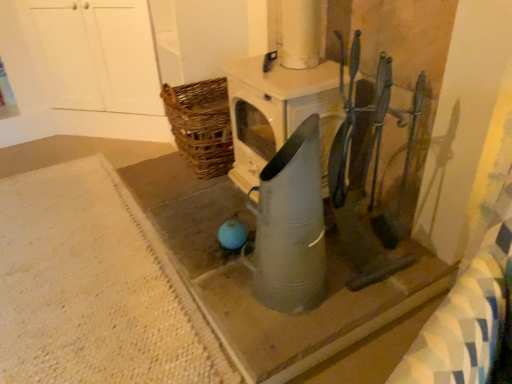
Question: Is metallic gray watering can at center, which is counted as the 2th concrete, starting from the left, located within metallic gray watering can at center?

Choices:
 (A) no
 (B) yes

Answer: (A)

Question: Could you tell me if metallic gray watering can at center is turned towards metallic gray watering can at center, which is counted as the 2th concrete, starting from the left?

Choices:
 (A) no
 (B) yes

Answer: (A)

Question: From a real-world perspective, is metallic gray watering can at center located beneath metallic gray watering can at center, which is counted as the 2th concrete, starting from the left?

Choices:
 (A) no
 (B) yes

Answer: (A)

Question: Can you confirm if metallic gray watering can at center is smaller than metallic gray watering can at center, the 1th concrete viewed from the right?

Choices:
 (A) no
 (B) yes

Answer: (B)

Question: Is metallic gray watering can at center positioned far away from metallic gray watering can at center, the 1th concrete viewed from the right?

Choices:
 (A) no
 (B) yes

Answer: (A)

Question: Which is correct: white textured rug at lower left, arranged as the second concrete when viewed from the right, is inside metallic gray watering can at center, which is counted as the 2th concrete, starting from the left, or outside of it?

Choices:
 (A) outside
 (B) inside

Answer: (A)

Question: From a real-world perspective, is white textured rug at lower left, arranged as the second concrete when viewed from the right, physically located above or below metallic gray watering can at center, which is counted as the 2th concrete, starting from the left?

Choices:
 (A) below
 (B) above

Answer: (A)

Question: Considering the positions of point (211, 345) and point (305, 319), is point (211, 345) closer or farther from the camera than point (305, 319)?

Choices:
 (A) farther
 (B) closer

Answer: (A)

Question: Looking at their shapes, would you say white textured rug at lower left, which is counted as the first concrete, starting from the left, is wider or thinner than metallic gray watering can at center, the 1th concrete viewed from the right?

Choices:
 (A) thin
 (B) wide

Answer: (B)

Question: From the image's perspective, relative to white textured rug at lower left, which is counted as the first concrete, starting from the left, is metallic gray watering can at center above or below?

Choices:
 (A) above
 (B) below

Answer: (A)

Question: Do you think metallic gray watering can at center is within white textured rug at lower left, which is counted as the first concrete, starting from the left, or outside of it?

Choices:
 (A) outside
 (B) inside

Answer: (A)

Question: In the image, is metallic gray watering can at center positioned in front of or behind white textured rug at lower left, which is counted as the first concrete, starting from the left?

Choices:
 (A) behind
 (B) front

Answer: (B)

Question: In the image, is metallic gray watering can at center on the left side or the right side of white textured rug at lower left, arranged as the second concrete when viewed from the right?

Choices:
 (A) right
 (B) left

Answer: (A)

Question: Considering their positions, is white textured rug at lower left, arranged as the second concrete when viewed from the right, located in front of or behind metallic gray watering can at center?

Choices:
 (A) behind
 (B) front

Answer: (A)

Question: In terms of size, does white textured rug at lower left, which is counted as the first concrete, starting from the left, appear bigger or smaller than metallic gray watering can at center?

Choices:
 (A) small
 (B) big

Answer: (B)